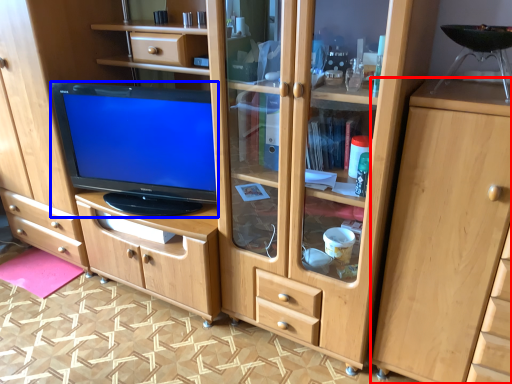
Question: Which of the following is the farthest to the observer, cabinetry (highlighted by a red box) or television (highlighted by a blue box)?

Choices:
 (A) cabinetry
 (B) television

Answer: (B)